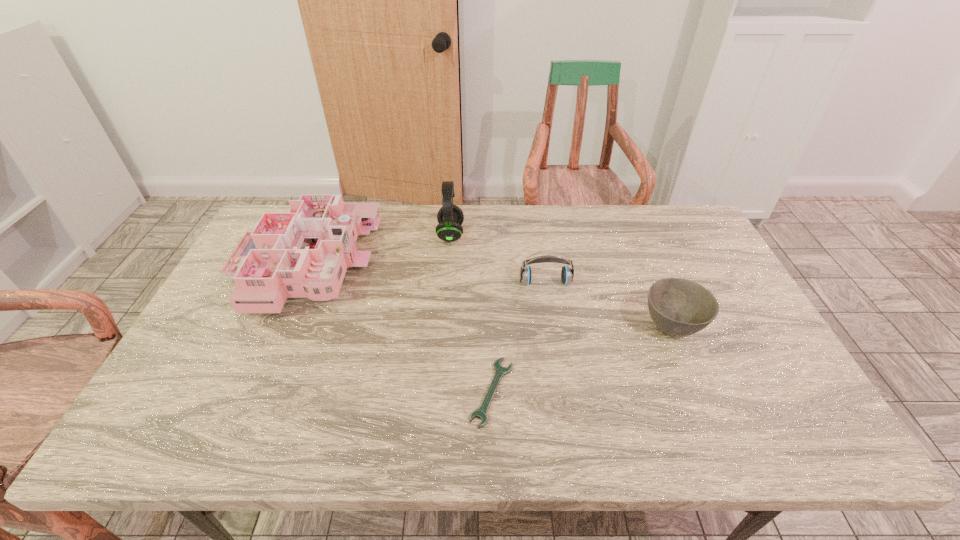
Where is `empty location between the nearest object and the shorter headset`? The height and width of the screenshot is (540, 960). empty location between the nearest object and the shorter headset is located at coordinates (518, 338).

Find the location of a particular element. The width and height of the screenshot is (960, 540). unoccupied area between the right headset and the nearest object is located at coordinates (518, 338).

Select which object appears as the closest to the third object from right to left. Please provide its 2D coordinates. Your answer should be formatted as a tuple, i.e. [(x, y)], where the tuple contains the x and y coordinates of a point satisfying the conditions above.

[(567, 274)]

Where is `object that ranks as the second closest to the rightmost object`? Image resolution: width=960 pixels, height=540 pixels. object that ranks as the second closest to the rightmost object is located at coordinates (500, 371).

At what (x,y) coordinates should I click in order to perform the action: click on vacant space that satisfies the following two spatial constraints: 1. at the front entrance of the rightmost object; 2. on the right side of the dollhouse. Please return your answer as a coordinate pair (x, y). The width and height of the screenshot is (960, 540). Looking at the image, I should click on (277, 325).

Find the location of a particular element. The image size is (960, 540). blank area in the image that satisfies the following two spatial constraints: 1. on the back side of the shortest object; 2. at the front entrance of the leftmost object is located at coordinates (490, 264).

At what (x,y) coordinates should I click in order to perform the action: click on free spot that satisfies the following two spatial constraints: 1. at the front entrance of the dollhouse; 2. on the back side of the bowl. Please return your answer as a coordinate pair (x, y). The height and width of the screenshot is (540, 960). Looking at the image, I should click on (277, 325).

In order to click on vacant area in the image that satisfies the following two spatial constraints: 1. on the ear cups of the taller headset; 2. on the back side of the rightmost object in this screenshot , I will do `click(444, 325)`.

This screenshot has height=540, width=960. Identify the location of vacant space that satisfies the following two spatial constraints: 1. on the back side of the bowl; 2. on the ear cups of the farther headset. click(635, 234).

Identify the location of free point that satisfies the following two spatial constraints: 1. on the ear cups of the nearest object; 2. on the right side of the taller headset. This screenshot has width=960, height=540. click(438, 392).